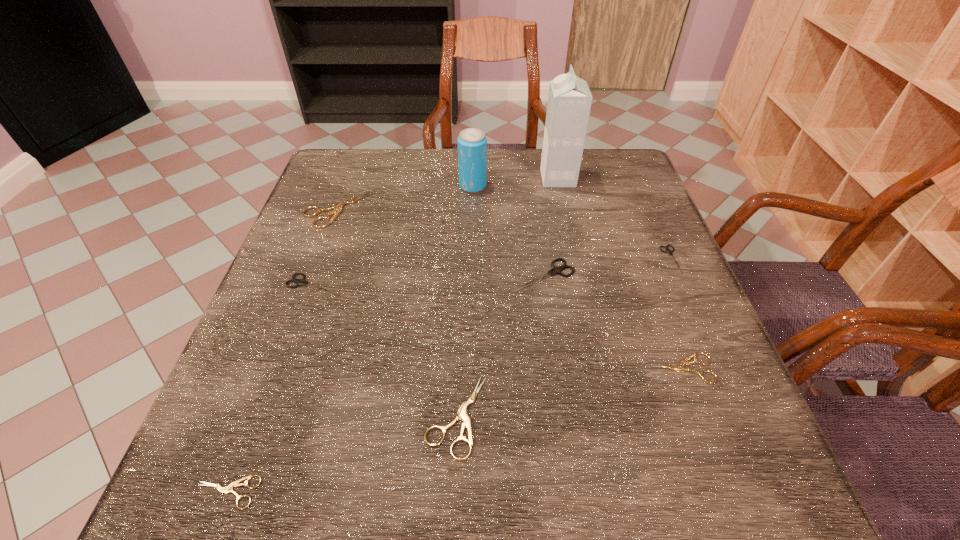
Locate an element on the screen. Image resolution: width=960 pixels, height=540 pixels. vacant space at the near edge is located at coordinates (306, 490).

This screenshot has width=960, height=540. In the image, there is a desktop. Find the location of `vacant region at the left edge`. vacant region at the left edge is located at coordinates (234, 382).

I want to click on vacant space at the right edge of the desktop, so click(746, 426).

Locate an element on the screen. vacant space at the far right corner of the desktop is located at coordinates (612, 190).

In the image, there is a desktop. At what (x,y) coordinates should I click in order to perform the action: click on free space at the near right corner. Please return your answer as a coordinate pair (x, y). The width and height of the screenshot is (960, 540). Looking at the image, I should click on (688, 449).

Where is `vacant space that's between the biggest black shears and the farthest beige shears`? The width and height of the screenshot is (960, 540). vacant space that's between the biggest black shears and the farthest beige shears is located at coordinates (440, 242).

Find the location of a particular element. vacant region between the third biggest beige shears and the carton is located at coordinates (619, 273).

Identify the location of free spot between the tallest object and the farthest beige shears. This screenshot has width=960, height=540. (447, 194).

Locate an element on the screen. The image size is (960, 540). free space between the farthest beige shears and the eighth shortest object is located at coordinates (405, 198).

The width and height of the screenshot is (960, 540). Find the location of `vacant space that is in between the third smallest beige shears and the rightmost beige shears`. vacant space that is in between the third smallest beige shears and the rightmost beige shears is located at coordinates (568, 392).